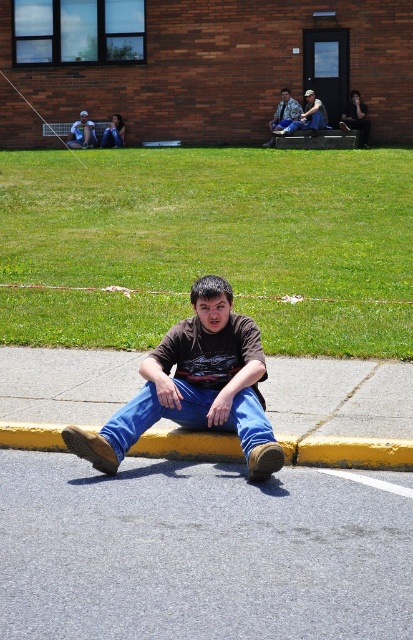
Question: Where is green grass at center located in relation to matte black jacket at upper left in the image?

Choices:
 (A) left
 (B) right

Answer: (B)

Question: Which object is positioned closest to the brown matte shirt at center?

Choices:
 (A) blue denim jeans at center
 (B) yellow painted curb at lower center

Answer: (A)

Question: Does yellow painted curb at lower center have a lesser width compared to denim jacket at upper center?

Choices:
 (A) no
 (B) yes

Answer: (A)

Question: From the image, what is the correct spatial relationship of green grass at center in relation to brown matte shirt at center?

Choices:
 (A) above
 (B) below

Answer: (A)

Question: Which point is closer to the camera?

Choices:
 (A) green grass at center
 (B) matte black jacket at upper left
 (C) gray asphalt at lower center

Answer: (C)

Question: Which of the following is the closest to the observer?

Choices:
 (A) matte black jacket at upper left
 (B) gray asphalt at lower center
 (C) green grass at center

Answer: (B)